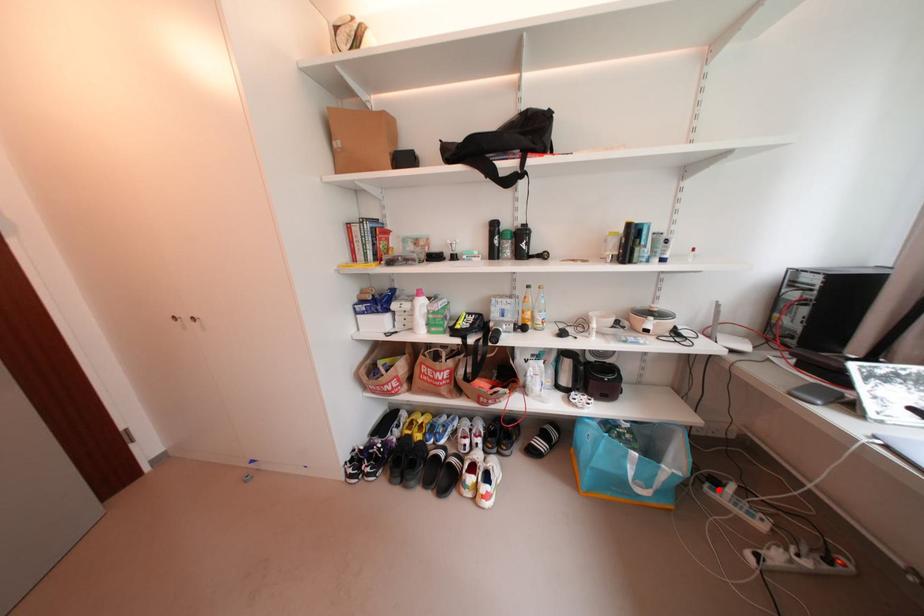
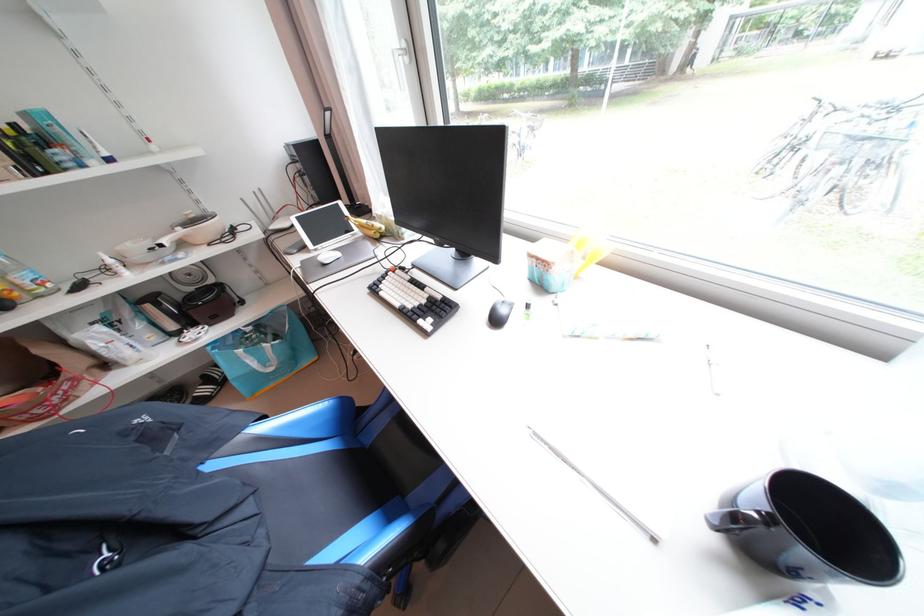
Question: I am providing you with two images of the same scene from different viewpoints. A red point is marked on the first image. At the location where the point appears in image 1, is it still visible in image 2?

Choices:
 (A) Yes
 (B) No

Answer: (B)